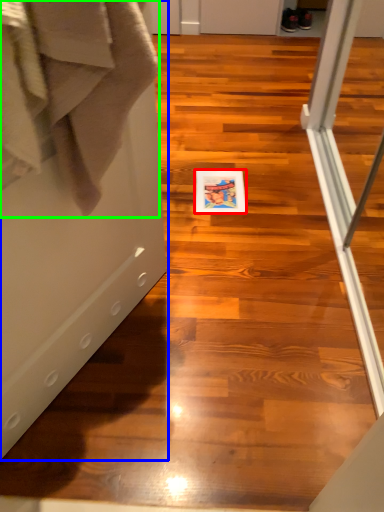
Question: Which object is the farthest from postcard (highlighted by a red box)? Choose among these: screen door (highlighted by a blue box) or bath towel (highlighted by a green box).

Choices:
 (A) screen door
 (B) bath towel

Answer: (B)